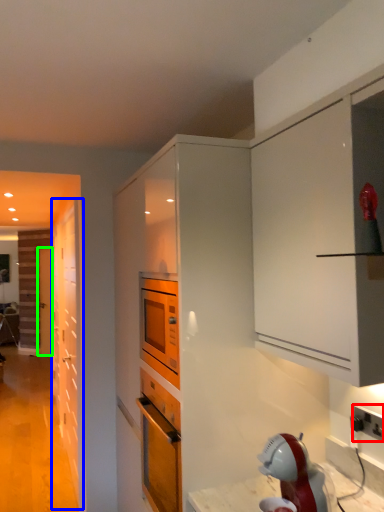
Question: Which is farther away from electric outlet (highlighted by a red box)? door (highlighted by a blue box) or door (highlighted by a green box)?

Choices:
 (A) door
 (B) door

Answer: (B)